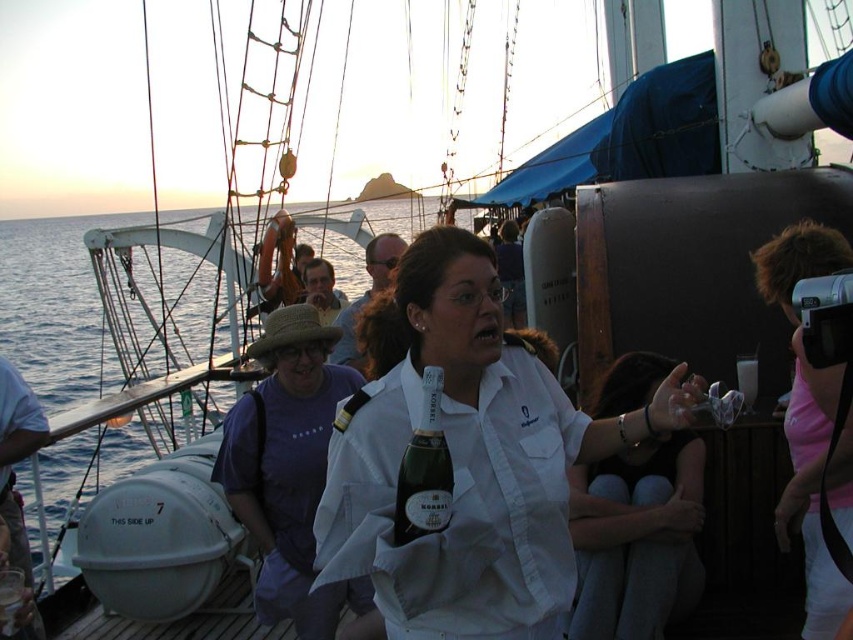
Question: Is pink fabric camera at right to the right of green glass bottle at center from the viewer's perspective?

Choices:
 (A) yes
 (B) no

Answer: (A)

Question: Does white shirt at center appear on the right side of purple cotton shirt at center?

Choices:
 (A) no
 (B) yes

Answer: (B)

Question: Which point is farther to the camera?

Choices:
 (A) (619, 451)
 (B) (811, 561)
 (C) (635, 625)
 (D) (277, 572)

Answer: (A)

Question: Among these objects, which one is farthest from the camera?

Choices:
 (A) white matte shirt at center
 (B) white shirt at center

Answer: (A)

Question: Can you confirm if purple cotton shirt at center is positioned to the left of white matte shirt at center?

Choices:
 (A) no
 (B) yes

Answer: (B)

Question: Estimate the real-world distances between objects in this image. Which object is farther from the green glass bottle at center?

Choices:
 (A) white shirt at center
 (B) purple cotton shirt at center

Answer: (B)